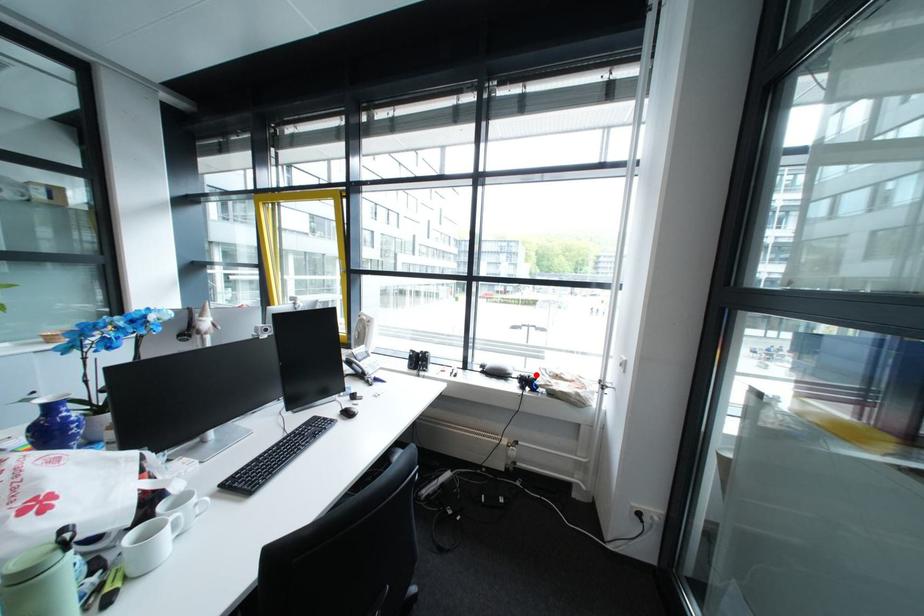
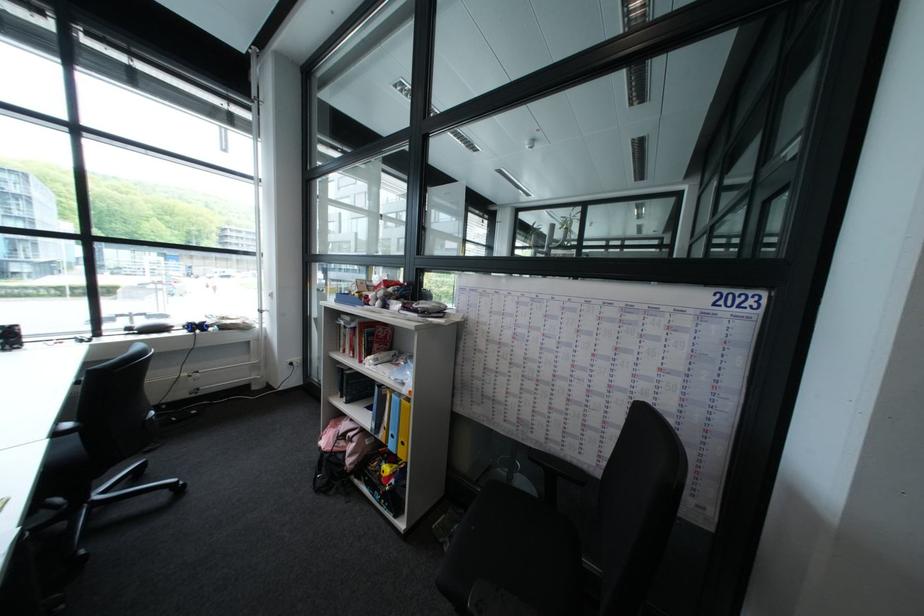
Question: I am providing you with two images of the same scene from different viewpoints. A red point is shown in image1. For the corresponding object point in image2, is it positioned nearer or farther from the camera?

Choices:
 (A) Nearer
 (B) Farther

Answer: (B)